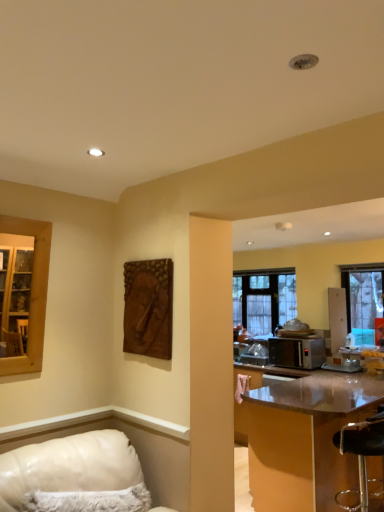
Question: Would you say brown textured wood at upper center is inside or outside satin silver microwave at right?

Choices:
 (A) outside
 (B) inside

Answer: (A)

Question: Is brown textured wood at upper center to the left or to the right of satin silver microwave at right in the image?

Choices:
 (A) right
 (B) left

Answer: (B)

Question: Which object is the closest to the clear glass window at center, marked as the second window in a right-to-left arrangement?

Choices:
 (A) clear glass window at right, the 2th window from the left
 (B) satin silver microwave at right
 (C) white leather couch at lower left
 (D) shiny brown table at right
 (E) brown textured wood at upper center

Answer: (B)

Question: Estimate the real-world distances between objects in this image. Which object is closer to the brown textured wood at upper center?

Choices:
 (A) clear glass window at center, positioned as the first window in back-to-front order
 (B) clear glass window at right, the 2th window when ordered from back to front
 (C) satin silver microwave at right
 (D) transparent plastic bar stool at lower right
 (E) white leather couch at lower left

Answer: (E)